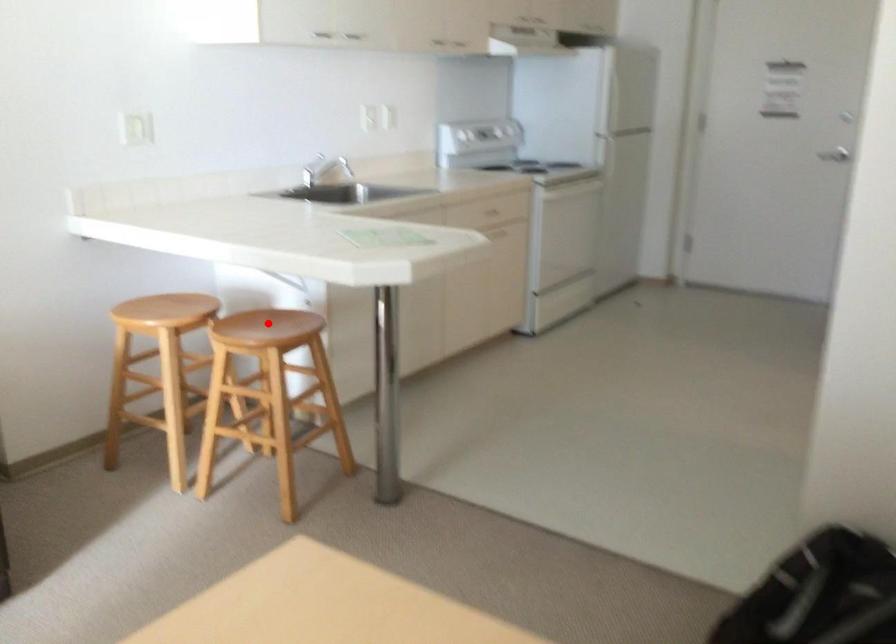
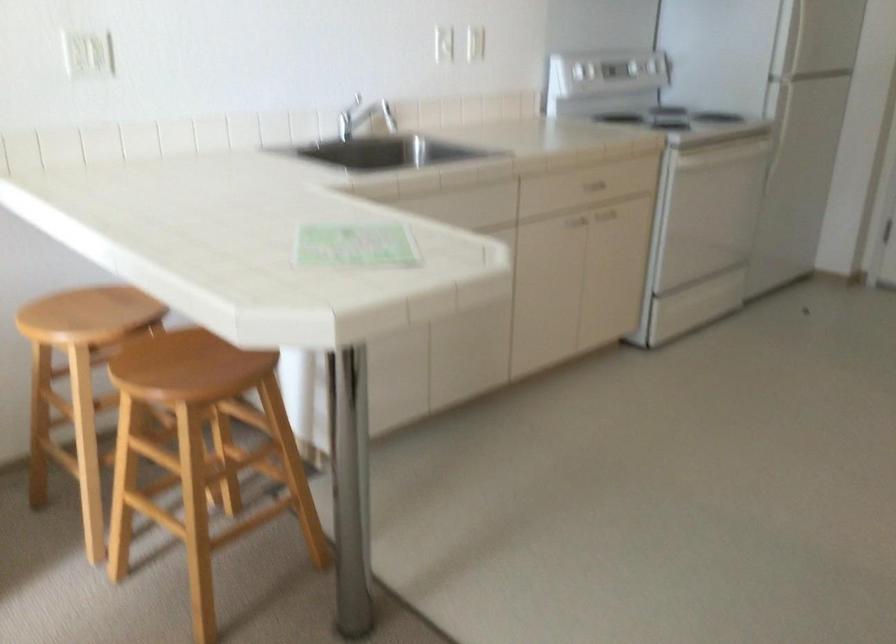
Find the pixel in the second image that matches the highlighted location in the first image.

(197, 357)